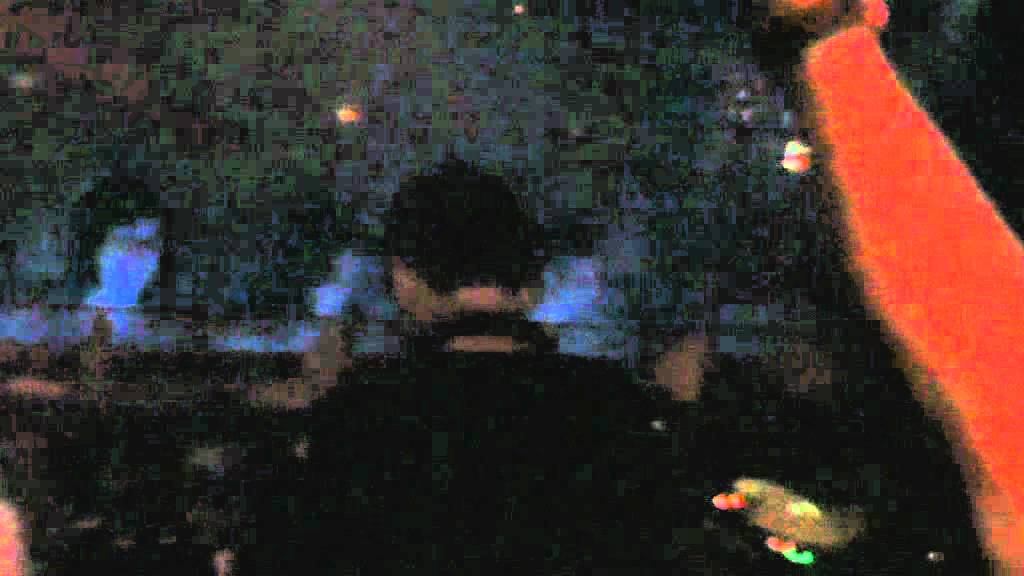
Locate an element on the screen. Image resolution: width=1024 pixels, height=576 pixels. painting is located at coordinates (496, 312).